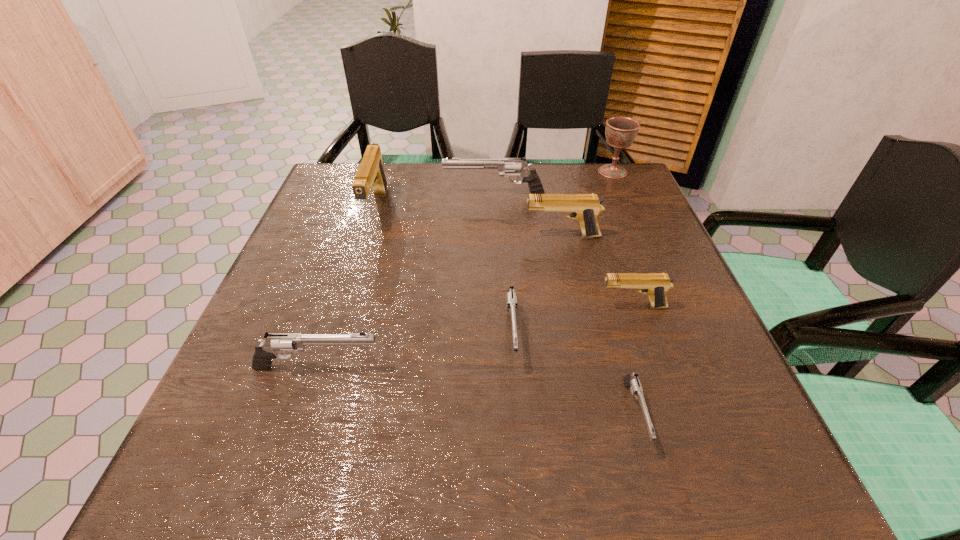
Identify the location of free point at the far edge. The image size is (960, 540). (402, 171).

In the image, there is a desktop. Identify the location of vacant space at the near edge. (623, 444).

The width and height of the screenshot is (960, 540). Identify the location of free space at the left edge of the desktop. (287, 395).

The height and width of the screenshot is (540, 960). I want to click on vacant space at the right edge of the desktop, so tap(674, 362).

Locate an element on the screen. The height and width of the screenshot is (540, 960). vacant area at the far left corner is located at coordinates (369, 196).

Locate an element on the screen. This screenshot has height=540, width=960. blank space at the near left corner is located at coordinates (279, 500).

This screenshot has width=960, height=540. Identify the location of vacant space at the far right corner of the desktop. (609, 179).

In the image, there is a desktop. Identify the location of vacant space at the near right corner. (770, 492).

Where is `vacant space that is in between the leftmost tan pistol and the third smallest silver pistol`? vacant space that is in between the leftmost tan pistol and the third smallest silver pistol is located at coordinates (347, 288).

This screenshot has width=960, height=540. I want to click on empty space between the second smallest silver pistol and the shortest object, so click(x=573, y=373).